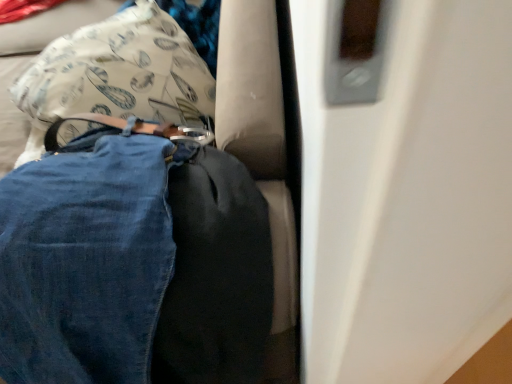
Question: Could denim at left be considered to be inside white fabric pillow at center?

Choices:
 (A) no
 (B) yes

Answer: (A)

Question: From the image's perspective, is white fabric pillow at center over denim at left?

Choices:
 (A) yes
 (B) no

Answer: (A)

Question: Does white fabric pillow at center turn towards denim at left?

Choices:
 (A) yes
 (B) no

Answer: (B)

Question: Is white fabric pillow at center to the left of denim at left from the viewer's perspective?

Choices:
 (A) yes
 (B) no

Answer: (A)

Question: Does white fabric pillow at center have a greater height compared to denim at left?

Choices:
 (A) yes
 (B) no

Answer: (B)

Question: From a real-world perspective, is white fabric pillow at center located higher than denim at left?

Choices:
 (A) yes
 (B) no

Answer: (B)

Question: Does denim at left have a larger size compared to white fabric pillow at center?

Choices:
 (A) no
 (B) yes

Answer: (B)

Question: Is denim at left completely or partially outside of white fabric pillow at center?

Choices:
 (A) no
 (B) yes

Answer: (B)

Question: From the image's perspective, is denim at left over white fabric pillow at center?

Choices:
 (A) yes
 (B) no

Answer: (B)

Question: Is denim at left positioned with its back to white fabric pillow at center?

Choices:
 (A) no
 (B) yes

Answer: (B)

Question: From the image's perspective, is denim at left below white fabric pillow at center?

Choices:
 (A) no
 (B) yes

Answer: (B)

Question: Is denim at left to the left of white fabric pillow at center from the viewer's perspective?

Choices:
 (A) yes
 (B) no

Answer: (B)

Question: From the image's perspective, is white fabric pillow at center above or below denim at left?

Choices:
 (A) above
 (B) below

Answer: (A)